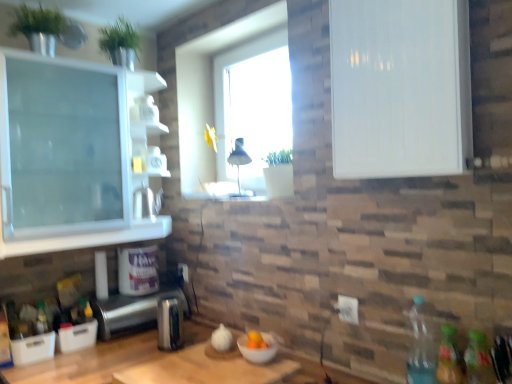
Locate an element on the screen. The height and width of the screenshot is (384, 512). free spot above transparent glass window at center (from a real-world perspective) is located at coordinates (238, 44).